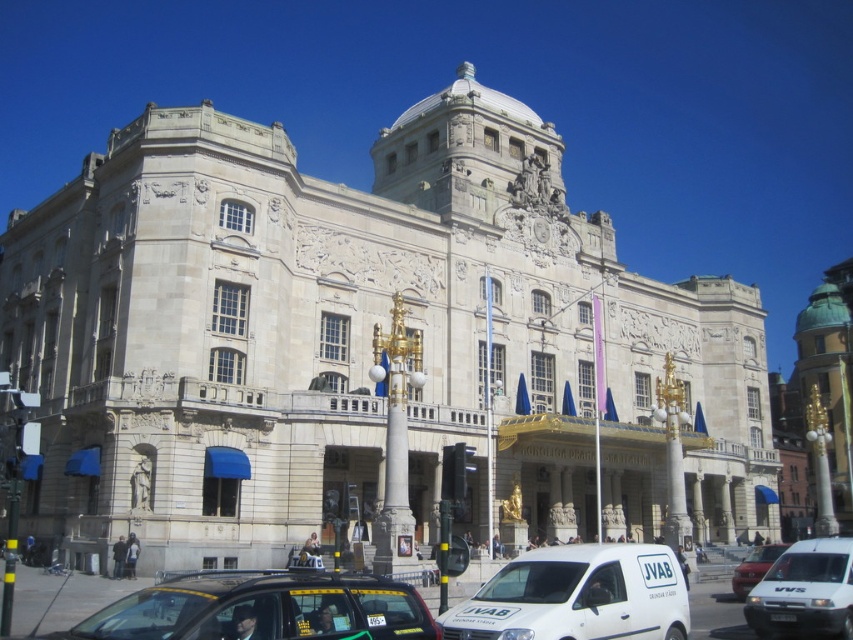
Question: Does white matte van at lower right lie in front of white van at center?

Choices:
 (A) no
 (B) yes

Answer: (B)

Question: Which object is the farthest from the white matte van at lower right?

Choices:
 (A) white van at center
 (B) white matte van at lower center
 (C) black matte taxi cab at lower left

Answer: (C)

Question: Among these points, which one is nearest to the camera?

Choices:
 (A) (189, 588)
 (B) (738, 596)
 (C) (831, 620)
 (D) (674, 636)

Answer: (A)

Question: Which object appears closest to the camera in this image?

Choices:
 (A) black matte taxi cab at lower left
 (B) white matte van at lower center
 (C) white van at center
 (D) white matte van at lower right

Answer: (A)

Question: Is black matte taxi cab at lower left above white van at center?

Choices:
 (A) yes
 (B) no

Answer: (A)

Question: Does black matte taxi cab at lower left lie behind white matte van at lower right?

Choices:
 (A) yes
 (B) no

Answer: (B)